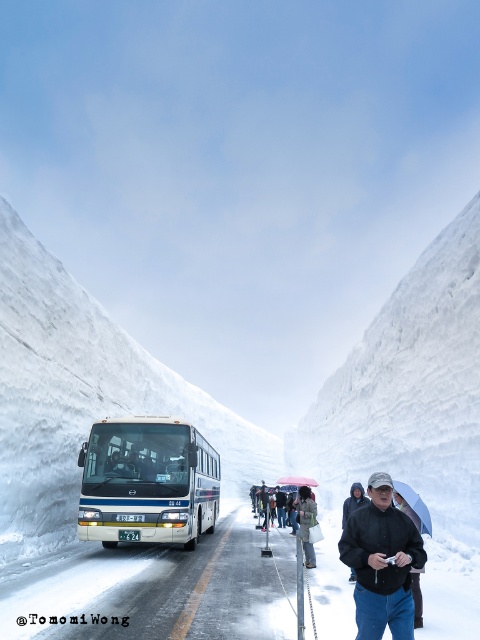
Is black matte jacket at lower right to the left of pink fabric umbrella at lower center from the viewer's perspective?

Yes, black matte jacket at lower right is to the left of pink fabric umbrella at lower center.

From the picture: Which is above, black matte jacket at lower right or pink fabric umbrella at lower center?

black matte jacket at lower right is above.

This screenshot has width=480, height=640. What are the coordinates of `black matte jacket at lower right` in the screenshot? It's located at (382, 563).

Locate an element on the screen. denim jacket at lower center is located at coordinates (307, 522).

Is point (315, 512) behind point (294, 476)?

No, (315, 512) is in front of (294, 476).

This screenshot has width=480, height=640. Identify the location of denim jacket at lower center. (307, 522).

Does white glossy bus at center appear on the right side of gray wool coat at center?

Incorrect, white glossy bus at center is not on the right side of gray wool coat at center.

Does white glossy bus at center have a greater width compared to gray wool coat at center?

No, white glossy bus at center is not wider than gray wool coat at center.

Is point (196, 531) more distant than point (280, 500)?

No, it is in front of (280, 500).

Where is `white glossy bus at center`? This screenshot has height=640, width=480. white glossy bus at center is located at coordinates (147, 481).